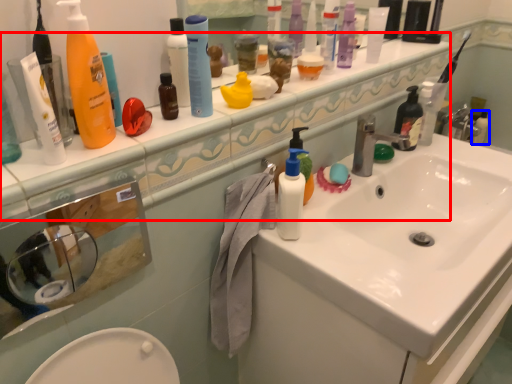
Question: Which object is further to the camera taking this photo, counter top (highlighted by a red box) or toiletry (highlighted by a blue box)?

Choices:
 (A) counter top
 (B) toiletry

Answer: (B)